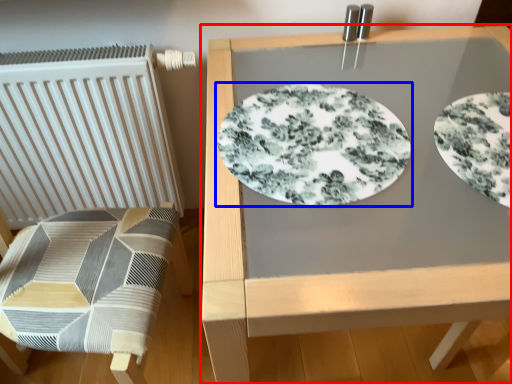
Question: Among these objects, which one is farthest to the camera, table (highlighted by a red box) or plate (highlighted by a blue box)?

Choices:
 (A) table
 (B) plate

Answer: (B)